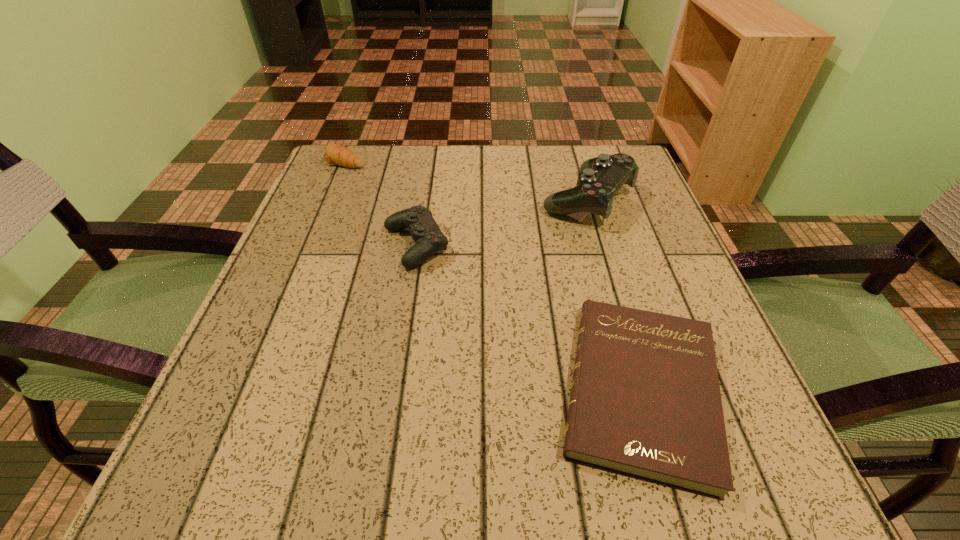
Find the location of a particular element. The width and height of the screenshot is (960, 540). object that is positioned at the near right corner is located at coordinates (645, 402).

Identify the location of vacant area at the far edge of the desktop. [x=490, y=167].

You are a GUI agent. You are given a task and a screenshot of the screen. Output one action in this format:
    pyautogui.click(x=<x>, y=<y>)
    Task: Click on the free space at the near edge of the desktop
    This screenshot has height=540, width=960.
    Given the screenshot: What is the action you would take?
    pyautogui.click(x=366, y=468)

In the image, there is a desktop. Where is `free region at the left edge`? The height and width of the screenshot is (540, 960). free region at the left edge is located at coordinates (319, 288).

This screenshot has width=960, height=540. In order to click on free space at the right edge of the desktop in this screenshot , I will do `click(630, 265)`.

In order to click on free space at the far left corner of the desktop in this screenshot , I will do point(341,183).

Find the location of `free region at the near left corner`. free region at the near left corner is located at coordinates (243, 472).

Identify the location of vacant space at the far right corner of the desktop. This screenshot has height=540, width=960. (570, 158).

This screenshot has width=960, height=540. Identify the location of unoccupied area between the right control and the second shortest object. (467, 179).

Where is `free spot between the left control and the nearest object`? The height and width of the screenshot is (540, 960). free spot between the left control and the nearest object is located at coordinates (528, 318).